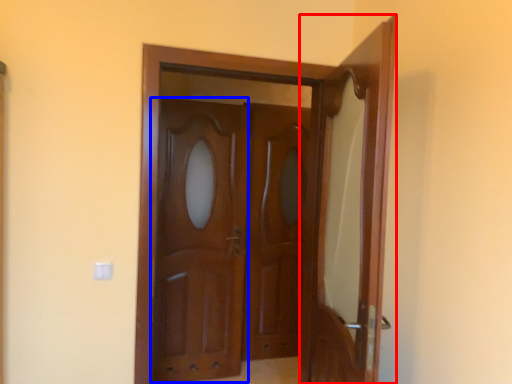
Question: Which of the following is the farthest to the observer, door (highlighted by a red box) or barn door (highlighted by a blue box)?

Choices:
 (A) door
 (B) barn door

Answer: (B)